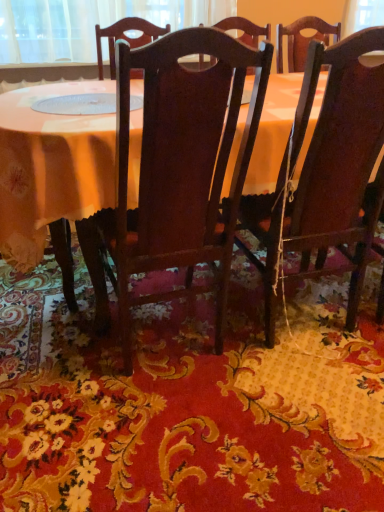
You are a GUI agent. You are given a task and a screenshot of the screen. Output one action in this format:
    pyautogui.click(x=<x>, y=<y>)
    Task: Click on the wooden table at center
    This screenshot has height=512, width=384.
    Given the screenshot: What is the action you would take?
    pyautogui.click(x=52, y=167)

Measure the distance between wooden table at center and camera.

wooden table at center is 3.53 feet away from camera.

This screenshot has height=512, width=384. Find the location of `dark wood chair at center, the 2th chair from the right`. dark wood chair at center, the 2th chair from the right is located at coordinates (176, 170).

Which object is wider, dark wood chair at right, placed as the 2th chair when sorted from left to right, or dark wood chair at center, the 2th chair from the right?

dark wood chair at right, placed as the 2th chair when sorted from left to right.

Is dark wood chair at center, the first chair positioned from the left, at the back of dark wood chair at right, placed as the first chair when sorted from right to left?

That's not correct — dark wood chair at right, placed as the first chair when sorted from right to left, is not looking away from dark wood chair at center, the first chair positioned from the left.

Which of these two, dark wood chair at right, placed as the first chair when sorted from right to left, or dark wood chair at center, the first chair positioned from the left, is bigger?

dark wood chair at right, placed as the first chair when sorted from right to left, is bigger.

Identify the location of chair that is behind the dark wood chair at center, the 2th chair from the right. This screenshot has height=512, width=384. (339, 159).

Is dark wood chair at center, the first chair positioned from the left, thinner than dark wood chair at right, placed as the first chair when sorted from right to left?

Yes.

Could you tell me if dark wood chair at center, the 2th chair from the right, is turned towards dark wood chair at right, placed as the first chair when sorted from right to left?

No, dark wood chair at center, the 2th chair from the right, does not turn towards dark wood chair at right, placed as the first chair when sorted from right to left.

Is dark wood chair at center, the first chair positioned from the left, beside dark wood chair at right, placed as the 2th chair when sorted from left to right?

No.

Considering the sizes of objects floral carpet at center and dark wood chair at right, placed as the 2th chair when sorted from left to right, in the image provided, who is shorter, floral carpet at center or dark wood chair at right, placed as the 2th chair when sorted from left to right,?

With less height is floral carpet at center.

Is floral carpet at center facing towards dark wood chair at right, placed as the first chair when sorted from right to left?

Yes.

Image resolution: width=384 pixels, height=512 pixels. Find the location of `mat below the dark wood chair at right, placed as the first chair when sorted from right to left (from the image's perspective)`. mat below the dark wood chair at right, placed as the first chair when sorted from right to left (from the image's perspective) is located at coordinates (189, 402).

Is floral carpet at center inside or outside of dark wood chair at right, placed as the 2th chair when sorted from left to right?

floral carpet at center is outside dark wood chair at right, placed as the 2th chair when sorted from left to right.

Visually, is dark wood chair at center, the first chair positioned from the left, positioned to the left or to the right of floral carpet at center?

dark wood chair at center, the first chair positioned from the left, is to the left of floral carpet at center.

What's the angular difference between dark wood chair at center, the first chair positioned from the left, and floral carpet at center's facing directions?

There is a 179-degree angle between the facing directions of dark wood chair at center, the first chair positioned from the left, and floral carpet at center.

From a real-world perspective, is dark wood chair at center, the 2th chair from the right, located higher than floral carpet at center?

Yes, from a real-world perspective, dark wood chair at center, the 2th chair from the right, is on top of floral carpet at center.

Who is smaller, dark wood chair at center, the 2th chair from the right, or floral carpet at center?

Smaller between the two is floral carpet at center.

Is dark wood chair at center, the 2th chair from the right, located within floral carpet at center?

No, dark wood chair at center, the 2th chair from the right, is not a part of floral carpet at center.

Is point (240, 478) in front of point (177, 255)?

Yes.

Is floral carpet at center not near dark wood chair at center, the 2th chair from the right?

floral carpet at center is actually quite close to dark wood chair at center, the 2th chair from the right.

Is floral carpet at center bigger or smaller than dark wood chair at center, the 2th chair from the right?

Considering their sizes, floral carpet at center takes up less space than dark wood chair at center, the 2th chair from the right.

Does wooden table at center have a lesser width compared to floral carpet at center?

Correct, the width of wooden table at center is less than that of floral carpet at center.

Is wooden table at center spatially inside floral carpet at center, or outside of it?

wooden table at center is spatially situated outside floral carpet at center.

Which is behind, point (35, 126) or point (278, 452)?

The point (278, 452) is farther.

Are wooden table at center and floral carpet at center located far from each other?

They are positioned close to each other.

Who is bigger, wooden table at center or dark wood chair at right, placed as the 2th chair when sorted from left to right?

Bigger between the two is wooden table at center.

Is wooden table at center inside the boundaries of dark wood chair at right, placed as the first chair when sorted from right to left, or outside?

wooden table at center is not enclosed by dark wood chair at right, placed as the first chair when sorted from right to left.

Is wooden table at center positioned with its back to dark wood chair at right, placed as the first chair when sorted from right to left?

Yes, wooden table at center is facing away from dark wood chair at right, placed as the first chair when sorted from right to left.

Is the position of wooden table at center more distant than that of dark wood chair at right, placed as the 2th chair when sorted from left to right?

Yes, it is.

Find the location of a particular element. Image resolution: width=384 pixels, height=512 pixels. chair that is above the dark wood chair at center, the 2th chair from the right (from the image's perspective) is located at coordinates (339, 159).

This screenshot has width=384, height=512. What are the coordinates of `chair on the left side of dark wood chair at right, placed as the 2th chair when sorted from left to right` in the screenshot? It's located at (176, 170).

Looking at this image, based on their spatial positions, is floral carpet at center or wooden table at center closer to dark wood chair at right, placed as the 2th chair when sorted from left to right?

floral carpet at center.

Estimate the real-world distances between objects in this image. Which object is closer to floral carpet at center, wooden table at center or dark wood chair at right, placed as the 2th chair when sorted from left to right?

dark wood chair at right, placed as the 2th chair when sorted from left to right.

When comparing their distances from wooden table at center, does dark wood chair at right, placed as the 2th chair when sorted from left to right, or floral carpet at center seem closer?

Based on the image, dark wood chair at right, placed as the 2th chair when sorted from left to right, appears to be nearer to wooden table at center.

Looking at the image, which one is located further to dark wood chair at center, the 2th chair from the right, dark wood chair at right, placed as the first chair when sorted from right to left, or wooden table at center?

dark wood chair at right, placed as the first chair when sorted from right to left, is positioned further to the anchor dark wood chair at center, the 2th chair from the right.

From the picture: When comparing their distances from wooden table at center, does dark wood chair at center, the first chair positioned from the left, or floral carpet at center seem closer?

Based on the image, dark wood chair at center, the first chair positioned from the left, appears to be nearer to wooden table at center.

Considering their positions, is wooden table at center positioned closer to dark wood chair at right, placed as the first chair when sorted from right to left, than floral carpet at center?

floral carpet at center is closer to dark wood chair at right, placed as the first chair when sorted from right to left.

From the image, which object appears to be nearer to dark wood chair at right, placed as the 2th chair when sorted from left to right, dark wood chair at center, the 2th chair from the right, or wooden table at center?

Among the two, dark wood chair at center, the 2th chair from the right, is located nearer to dark wood chair at right, placed as the 2th chair when sorted from left to right.

Considering their positions, is dark wood chair at right, placed as the 2th chair when sorted from left to right, positioned further to wooden table at center than dark wood chair at center, the 2th chair from the right?

dark wood chair at right, placed as the 2th chair when sorted from left to right, is positioned further to the anchor wooden table at center.

The image size is (384, 512). Identify the location of table between dark wood chair at center, the first chair positioned from the left, and dark wood chair at right, placed as the 2th chair when sorted from left to right, in the horizontal direction. (52, 167).

At what (x,y) coordinates should I click in order to perform the action: click on chair that lies between dark wood chair at right, placed as the 2th chair when sorted from left to right, and floral carpet at center from top to bottom. Please return your answer as a coordinate pair (x, y). Looking at the image, I should click on (176, 170).